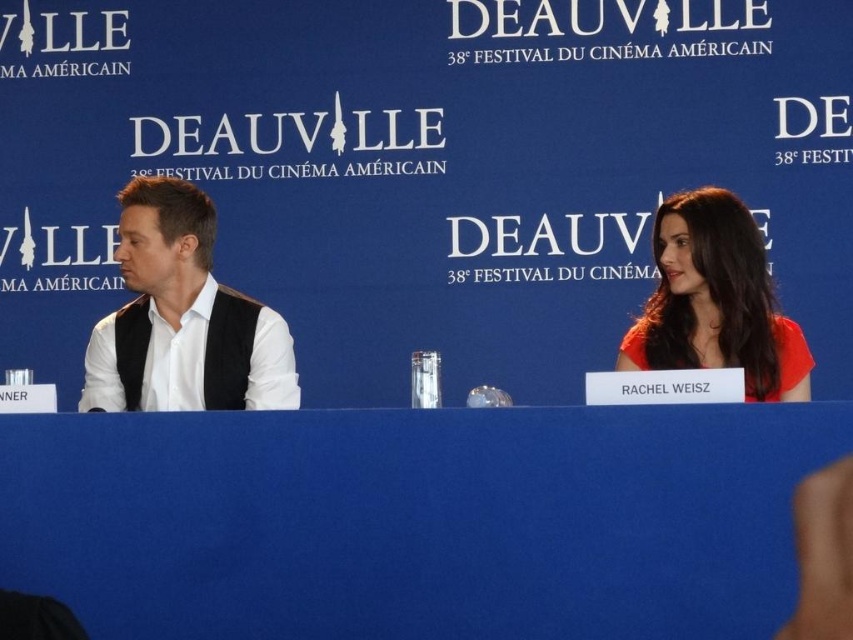
Is blue fabric table at center closer to camera compared to matte red dress at right?

Yes.

Does blue fabric table at center have a smaller size compared to matte red dress at right?

Actually, blue fabric table at center might be larger than matte red dress at right.

Consider the image. Who is more forward, (409, 572) or (720, 253)?

Point (409, 572) is in front.

Identify the location of blue fabric table at center. pyautogui.click(x=415, y=520).

Is blue fabric table at center thinner than white matte vest at left?

In fact, blue fabric table at center might be wider than white matte vest at left.

Who is shorter, blue fabric table at center or white matte vest at left?

With less height is blue fabric table at center.

Is point (648, 477) closer to viewer compared to point (202, 273)?

Yes, point (648, 477) is closer to viewer.

At what (x,y) coordinates should I click in order to perform the action: click on blue fabric table at center. Please return your answer as a coordinate pair (x, y). Looking at the image, I should click on (415, 520).

Is point (161, 195) farther from camera compared to point (694, 276)?

Yes, point (161, 195) is farther from viewer.

Looking at this image, does white matte vest at left have a lesser height compared to matte red dress at right?

In fact, white matte vest at left may be taller than matte red dress at right.

The width and height of the screenshot is (853, 640). I want to click on white matte vest at left, so click(183, 317).